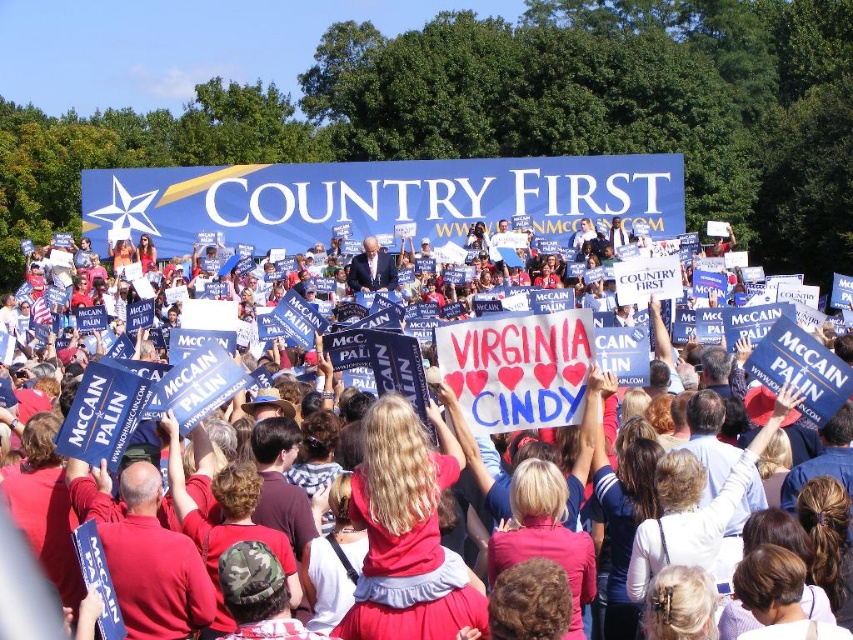
From the picture: You are a photographer at the rally. You want to capture a photo of the McCain and Palin signs held by the crowd. The point at coordinate (804, 371) is part of the red fabric crowd at center. Will this point be obscured by any objects in the scene?

The point at coordinate (804, 371) is on the red fabric crowd at center, so it will not be obscured by any objects since the crowd is holding signs above their heads and the point is on the fabric of the crowd itself.

You are a photographer at the political rally. You want to take a photo of the blue fabric suit at center without the red fabric crowd at center appearing in the foreground. Is this possible based on their positions?

The red fabric crowd at center is positioned under the blue fabric suit at center, so the blue fabric suit is above the crowd. Therefore, you can take a photo of the blue fabric suit at center without the red fabric crowd at center in the foreground by angling the camera upwards to focus on the higher position of the suit.

You are a photographer standing at the edge of the crowd. You want to take a photo that includes both the red fabric crowd at center and the blue fabric suit at center. Given that your camera has a maximum focus range of 80 feet, will you be able to capture both subjects clearly in the same frame?

The red fabric crowd at center is 81.25 feet away from the blue fabric suit at center. Since the distance between them exceeds the camera maximum focus range of 80 feet, you won